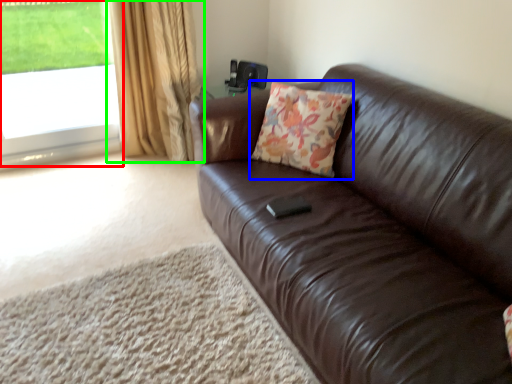
Question: Considering the real-world distances, which object is closest to window (highlighted by a red box)? throw pillow (highlighted by a blue box) or curtain (highlighted by a green box).

Choices:
 (A) throw pillow
 (B) curtain

Answer: (B)